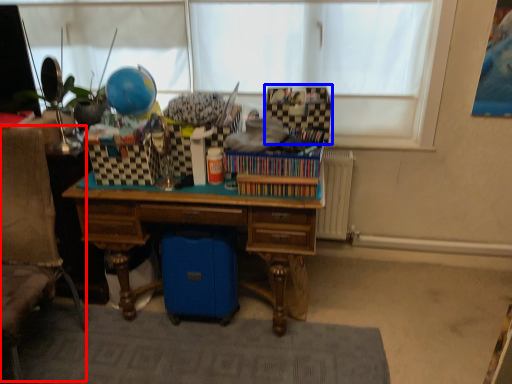
Question: Which object appears closest to the camera in this image, swivel chair (highlighted by a red box) or storage box (highlighted by a blue box)?

Choices:
 (A) swivel chair
 (B) storage box

Answer: (A)